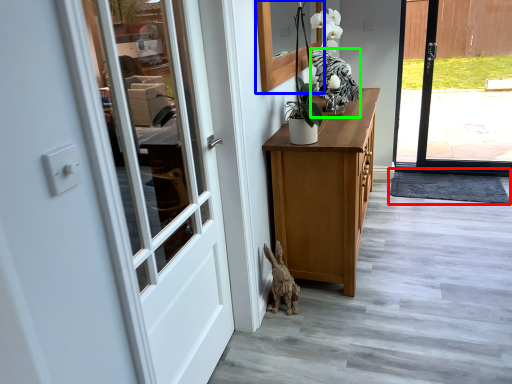
Question: Which is nearer to the doormat (highlighted by a red box)? window (highlighted by a blue box) or animal (highlighted by a green box).

Choices:
 (A) window
 (B) animal

Answer: (B)